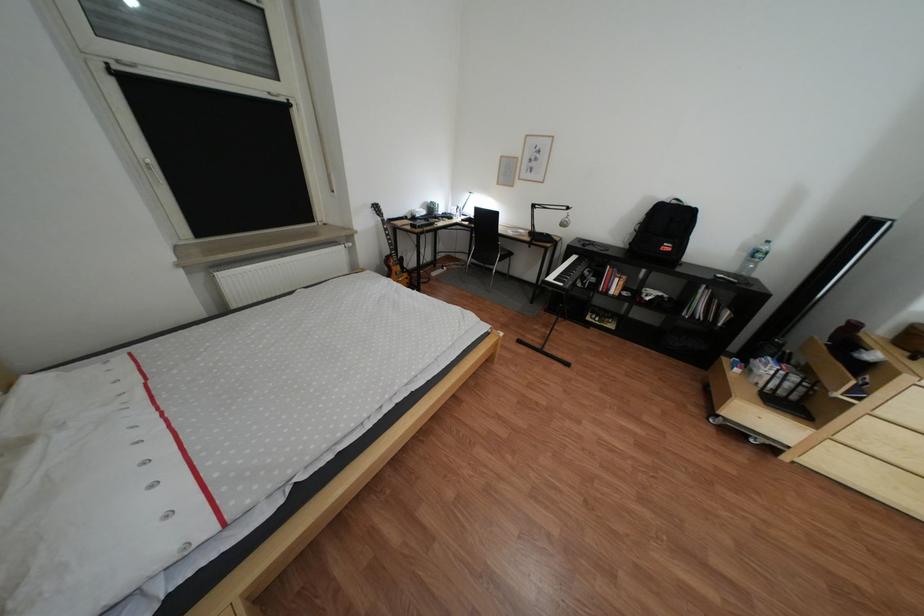
Which object does [592,245] point to?

It refers to a microphone on stand.